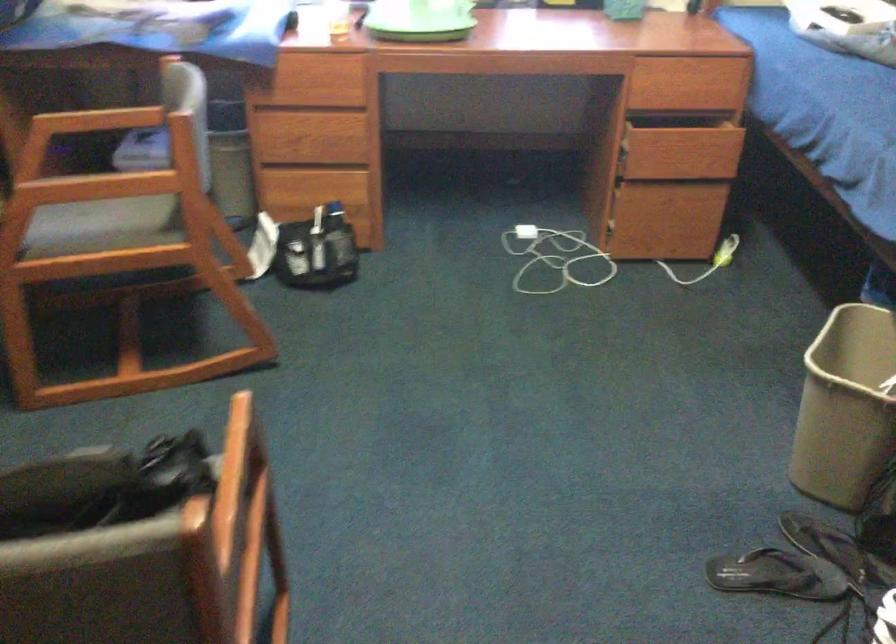
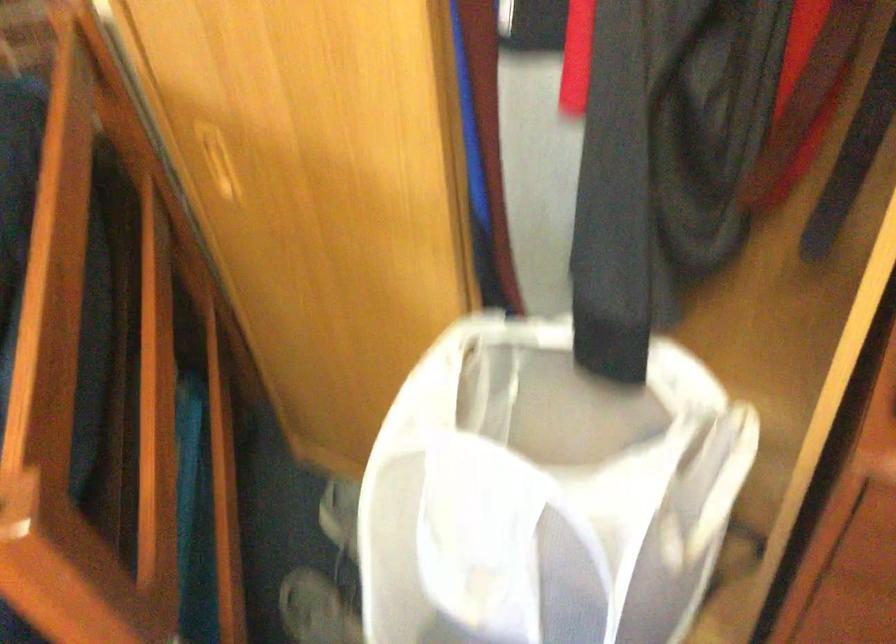
First-person continuous shooting, in which direction is the camera rotating?

The camera's rotation is toward right-down.